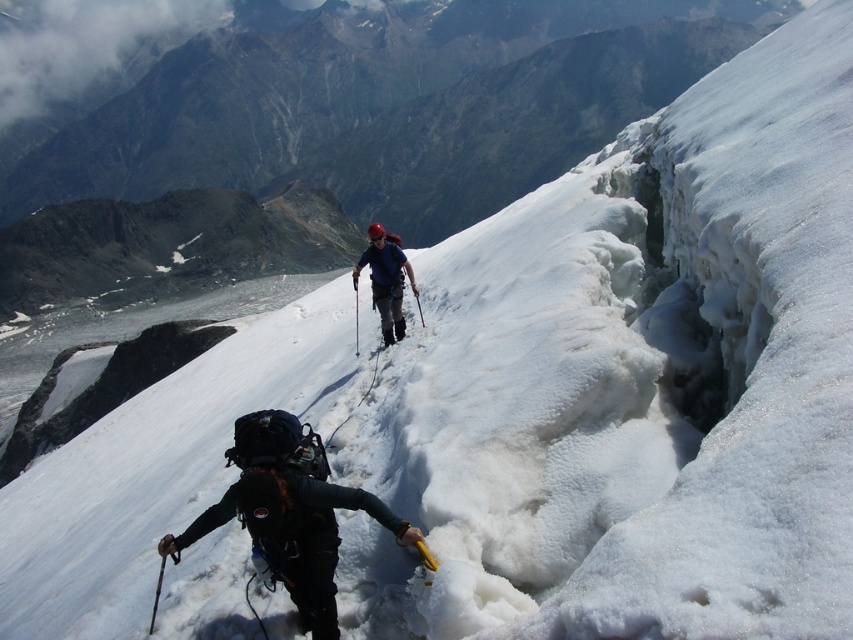
Looking at this image, you are a hiker planning to carry both the black nylon backpack at center and the matte blue jacket at center. Which item is shorter in height?

The black nylon backpack at center is not as tall as the matte blue jacket at center, so the backpack is shorter in height.

You are a mountaineer planning to retrieve an item from your backpack while climbing. Given the positioning of the black nylon backpack at center and the matte blue jacket at center, which item is easier to access without adjusting your climbing position?

The black nylon backpack at center is positioned under the matte blue jacket at center, so it might be more accessible without needing to adjust your jacket or climbing position.

You are a mountaineer planning to move from the current position to the crevasse on the left. You have to pass through the area where the black nylon backpack at center and matte blue jacket at center are located. Which object should you avoid stepping on to maintain balance?

You should avoid stepping on the black nylon backpack at center because it is positioned on the right side of matte blue jacket at center, so stepping on it might disrupt your balance while navigating the steep slope.